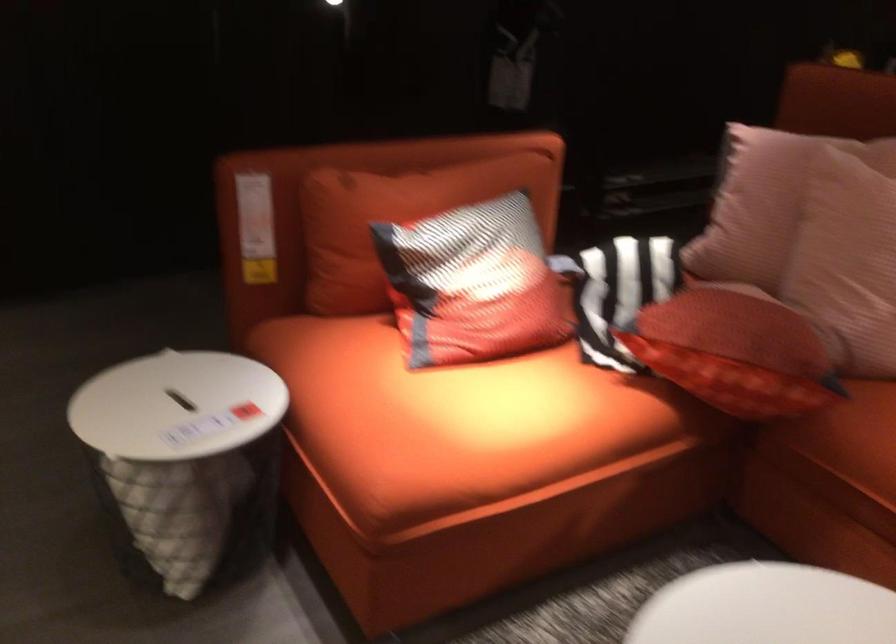
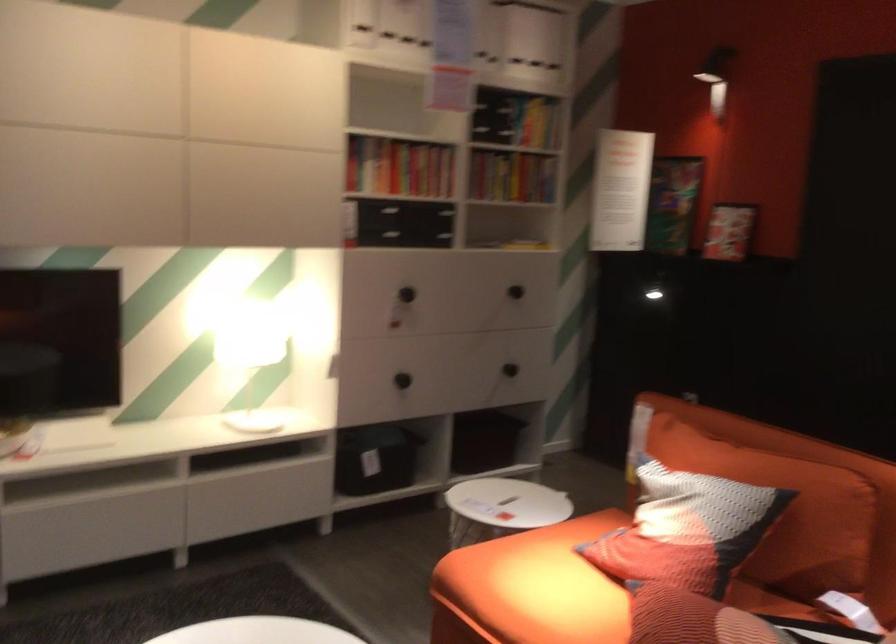
Where in the second image is the point corresponding to (490,424) from the first image?

(531, 588)